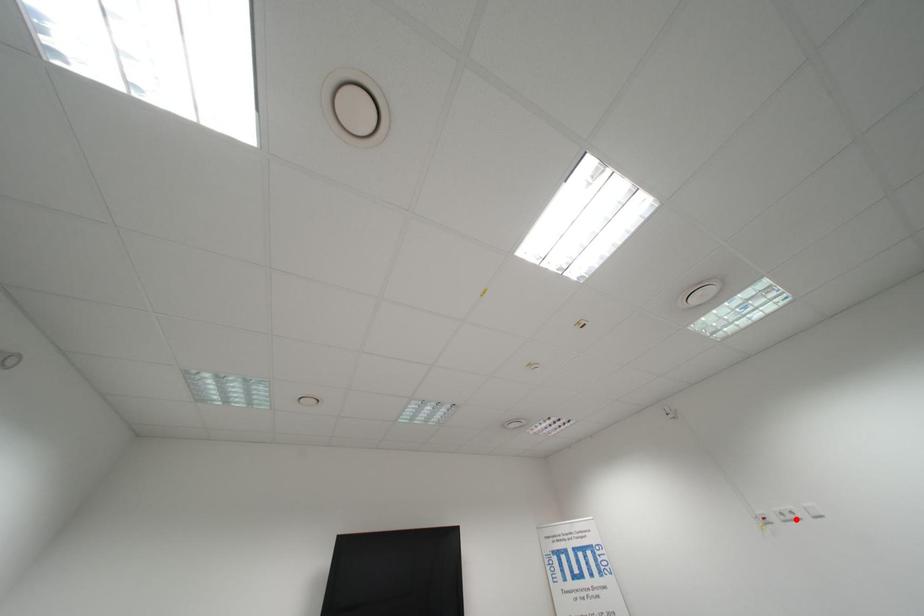
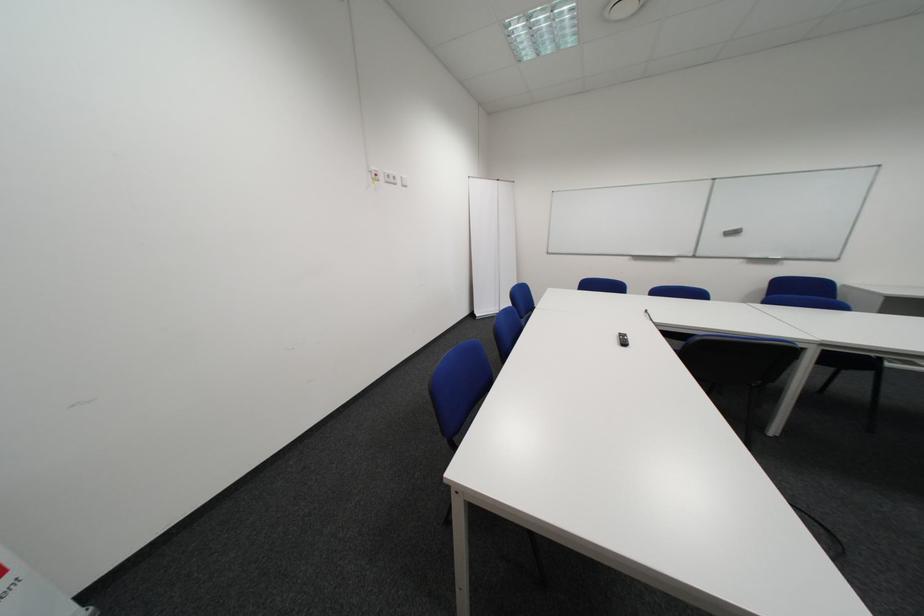
The point at the highlighted location is marked in the first image. Where is the corresponding point in the second image?

(398, 180)